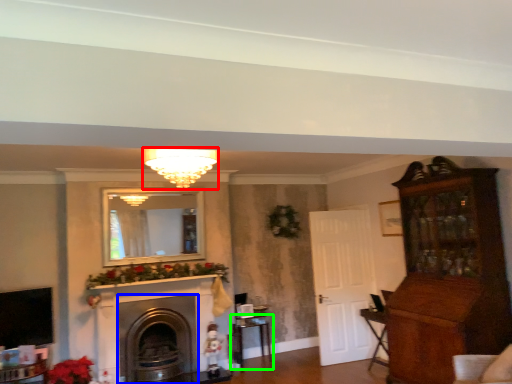
Question: Based on their relative distances, which object is farther from light fixture (highlighted by a red box)? Choose from fireplace (highlighted by a blue box) and table (highlighted by a green box).

Choices:
 (A) fireplace
 (B) table

Answer: (B)